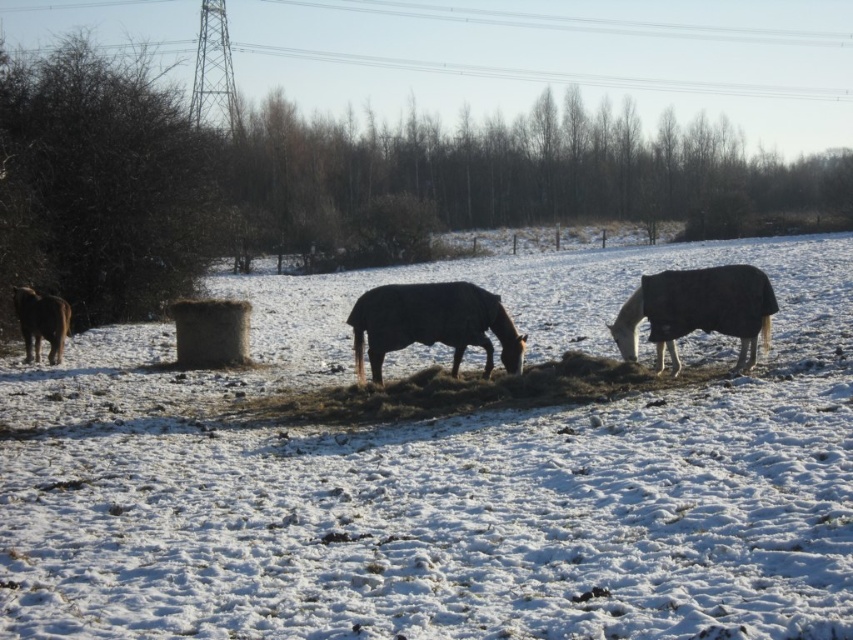
Can you confirm if black glossy horse at right is bigger than brown furry horse at left?

Indeed, black glossy horse at right has a larger size compared to brown furry horse at left.

Based on the photo, which is more to the left, black glossy horse at right or brown furry horse at left?

Positioned to the left is brown furry horse at left.

Is point (762, 275) positioned in front of point (22, 310)?

Yes, point (762, 275) is in front of point (22, 310).

This screenshot has width=853, height=640. I want to click on black glossy horse at right, so click(697, 310).

Who is positioned more to the right, white fluffy snow at center or brown furry horse at left?

Positioned to the right is white fluffy snow at center.

Does point (451, 461) lie behind point (35, 340)?

That is False.

Who is more distant from viewer, (265,566) or (30,300)?

Positioned behind is point (30,300).

At what (x,y) coordinates should I click in order to perform the action: click on white fluffy snow at center. Please return your answer as a coordinate pair (x, y). The width and height of the screenshot is (853, 640). Looking at the image, I should click on (439, 477).

Which is in front, point (161, 616) or point (421, 342)?

Point (161, 616)

Which is more to the left, white fluffy snow at center or brown matte horse at center?

From the viewer's perspective, brown matte horse at center appears more on the left side.

In order to click on white fluffy snow at center in this screenshot , I will do `click(439, 477)`.

You are a GUI agent. You are given a task and a screenshot of the screen. Output one action in this format:
    pyautogui.click(x=<x>, y=<y>)
    Task: Click on the white fluffy snow at center
    The height and width of the screenshot is (640, 853).
    Given the screenshot: What is the action you would take?
    pyautogui.click(x=439, y=477)